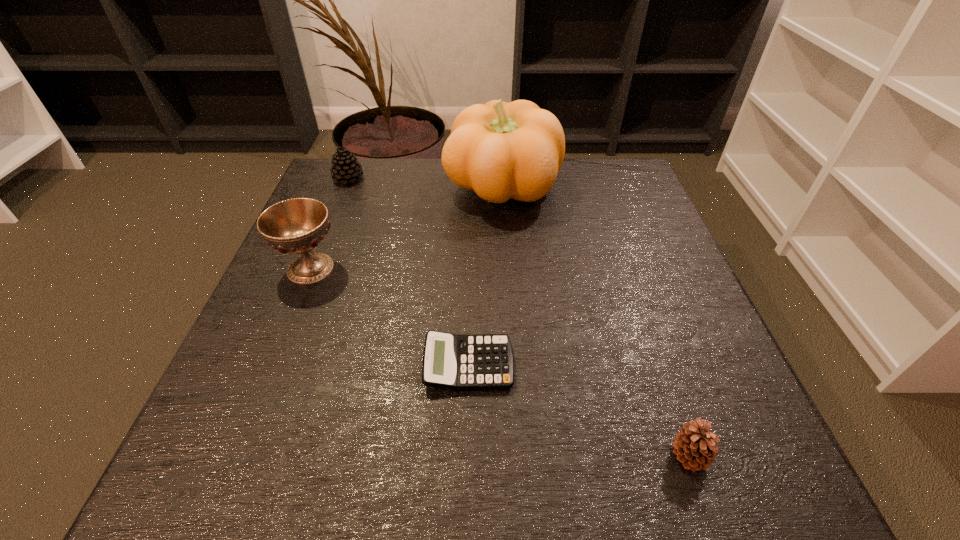
The width and height of the screenshot is (960, 540). Find the location of `vacant area located 0.310m at the narrow end of the left pinecone`. vacant area located 0.310m at the narrow end of the left pinecone is located at coordinates (311, 272).

Image resolution: width=960 pixels, height=540 pixels. I want to click on vacant position located on the back of the right pinecone, so click(x=636, y=303).

I want to click on vacant space located on the back of the shortest object, so click(x=472, y=215).

Identify the location of pumpkin that is at the far edge. (500, 150).

Find the location of a particular element. The width and height of the screenshot is (960, 540). pinecone positioned at the far edge is located at coordinates (345, 168).

Where is `object located in the near edge section of the desktop`? The width and height of the screenshot is (960, 540). object located in the near edge section of the desktop is located at coordinates (694, 445).

The height and width of the screenshot is (540, 960). Find the location of `chalice that is positioned at the left edge`. chalice that is positioned at the left edge is located at coordinates (296, 226).

Where is `pinecone that is at the left edge`? The height and width of the screenshot is (540, 960). pinecone that is at the left edge is located at coordinates (345, 168).

Where is `object positioned at the right edge`? Image resolution: width=960 pixels, height=540 pixels. object positioned at the right edge is located at coordinates (694, 445).

Locate an element on the screen. The image size is (960, 540). object that is at the far left corner is located at coordinates (345, 168).